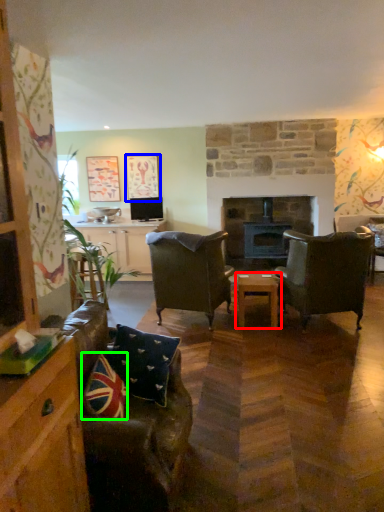
Question: Based on their relative distances, which object is farther from table (highlighted by a red box)? Choose from picture frame (highlighted by a blue box) and pillow (highlighted by a green box).

Choices:
 (A) picture frame
 (B) pillow

Answer: (A)